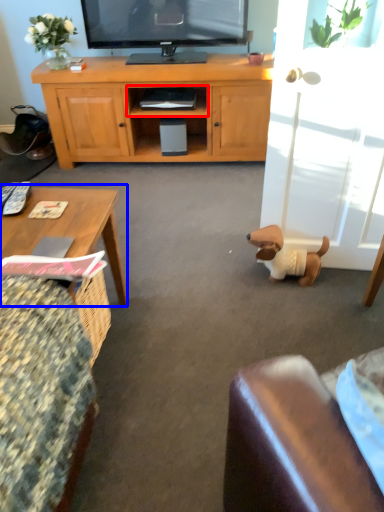
Question: Which of the following is the closest to the observer, shelf (highlighted by a red box) or coffee table (highlighted by a blue box)?

Choices:
 (A) shelf
 (B) coffee table

Answer: (B)